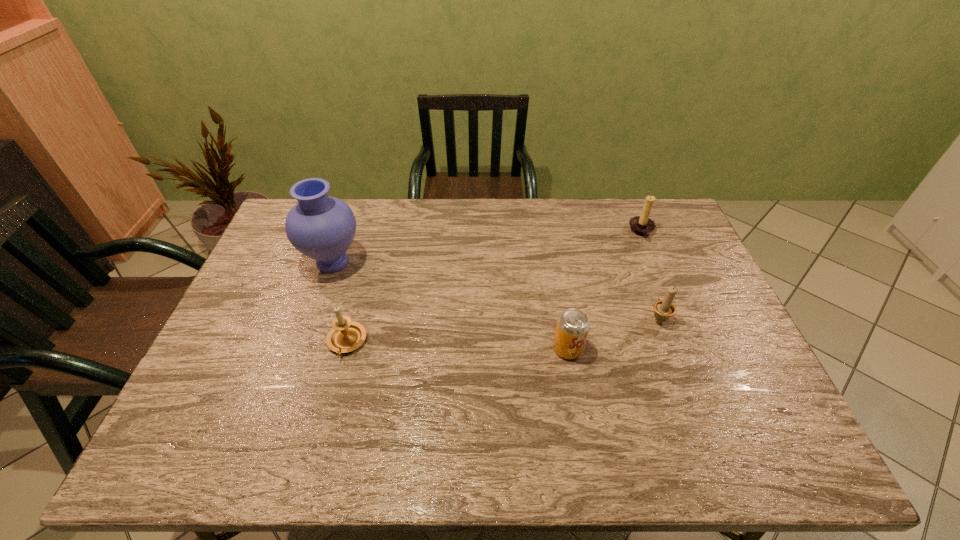
Find the location of a particular element. object that is at the far edge is located at coordinates (642, 225).

You are a GUI agent. You are given a task and a screenshot of the screen. Output one action in this format:
    pyautogui.click(x=<x>, y=<y>)
    Task: Click on the object that is at the left edge
    The width and height of the screenshot is (960, 540).
    Given the screenshot: What is the action you would take?
    pyautogui.click(x=321, y=227)

Where is `object present at the right edge`? This screenshot has height=540, width=960. object present at the right edge is located at coordinates (642, 225).

At what (x,y) coordinates should I click in order to perform the action: click on object situated at the far right corner. Please return your answer as a coordinate pair (x, y). The image size is (960, 540). Looking at the image, I should click on (642, 225).

In the image, there is a desktop. At what (x,y) coordinates should I click in order to perform the action: click on vacant area at the far edge. Please return your answer as a coordinate pair (x, y). The image size is (960, 540). Looking at the image, I should click on (477, 203).

The image size is (960, 540). In the image, there is a desktop. In order to click on vacant region at the near edge in this screenshot , I will do `click(246, 451)`.

Where is `vacant area at the left edge`? vacant area at the left edge is located at coordinates (261, 352).

In the image, there is a desktop. Identify the location of blank space at the right edge. The image size is (960, 540). (730, 352).

The image size is (960, 540). Find the location of `free region at the near left corner of the desktop`. free region at the near left corner of the desktop is located at coordinates (212, 468).

This screenshot has width=960, height=540. I want to click on free spot between the vase and the leftmost candle holder, so point(340,302).